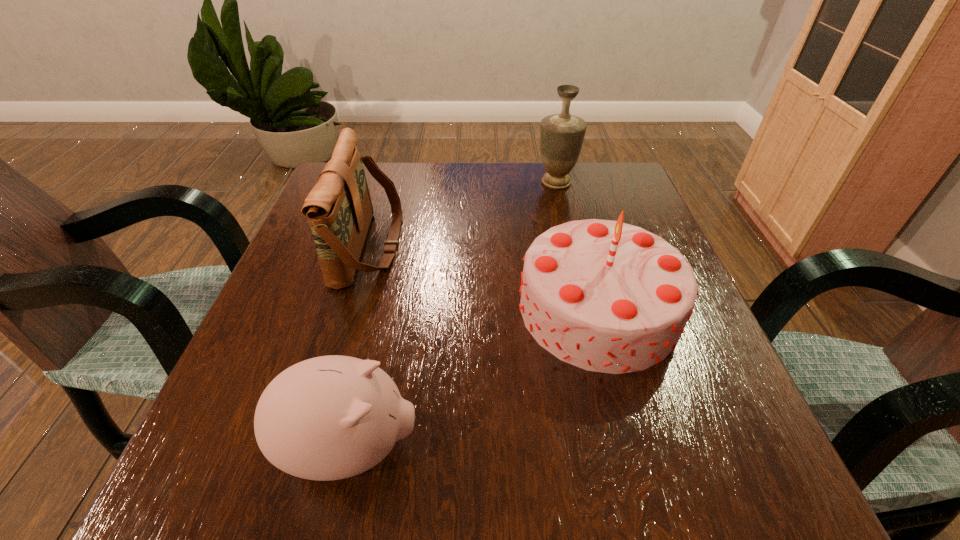
Where is `shoulder bag present at the far edge`? shoulder bag present at the far edge is located at coordinates (339, 209).

Locate an element on the screen. object that is positioned at the near edge is located at coordinates (332, 417).

Locate an element on the screen. This screenshot has width=960, height=540. shoulder bag positioned at the left edge is located at coordinates (339, 209).

This screenshot has width=960, height=540. Find the location of `piggy bank that is at the left edge`. piggy bank that is at the left edge is located at coordinates (332, 417).

Identify the location of urn that is at the right edge. (561, 135).

This screenshot has height=540, width=960. Find the location of `birthday cake present at the right edge`. birthday cake present at the right edge is located at coordinates point(605,296).

At what (x,y) coordinates should I click in order to perform the action: click on object at the far left corner. Please return your answer as a coordinate pair (x, y). Looking at the image, I should click on (339, 209).

You are a GUI agent. You are given a task and a screenshot of the screen. Output one action in this format:
    pyautogui.click(x=<x>, y=<y>)
    Task: Click on the object that is at the near left corner
    The height and width of the screenshot is (540, 960).
    Given the screenshot: What is the action you would take?
    pos(332,417)

You are a GUI agent. You are given a task and a screenshot of the screen. Output one action in this format:
    pyautogui.click(x=<x>, y=<y>)
    Task: Click on the object positioned at the far right corner
    The image size is (960, 540).
    Given the screenshot: What is the action you would take?
    pyautogui.click(x=561, y=135)

In the image, there is a desktop. At what (x,y) coordinates should I click in order to perform the action: click on free space at the far edge. Please return your answer as a coordinate pair (x, y). Looking at the image, I should click on (420, 161).